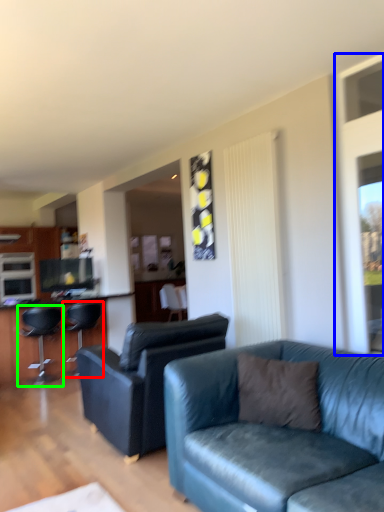
Question: Which is farther away from chair (highlighted by a red box)? window screen (highlighted by a blue box) or chair (highlighted by a green box)?

Choices:
 (A) window screen
 (B) chair

Answer: (A)